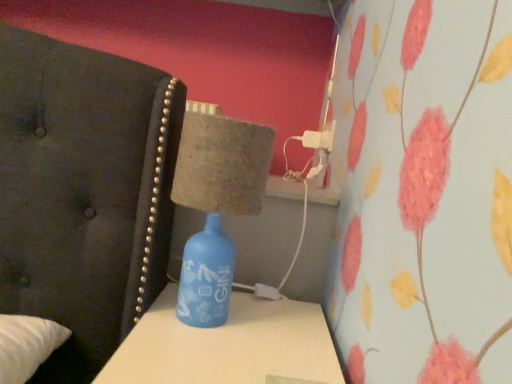
Describe the element at coordinates (83, 192) in the screenshot. Image resolution: width=512 pixels, height=384 pixels. I see `blue glass bottle at left` at that location.

What is the approximate width of blue glass bottle at left?

It is 7.05 feet.

In order to face blue glass bottle at left, should I rotate leftwards or rightwards?

Turn left by 32.886 degrees to look at blue glass bottle at left.

Where is `blue glass bottle at left`? blue glass bottle at left is located at coordinates (83, 192).

Measure the distance between blue glass bottle at left and camera.

The distance of blue glass bottle at left from camera is 28.31 inches.

Image resolution: width=512 pixels, height=384 pixels. I want to click on blue glass bottle at left, so click(x=83, y=192).